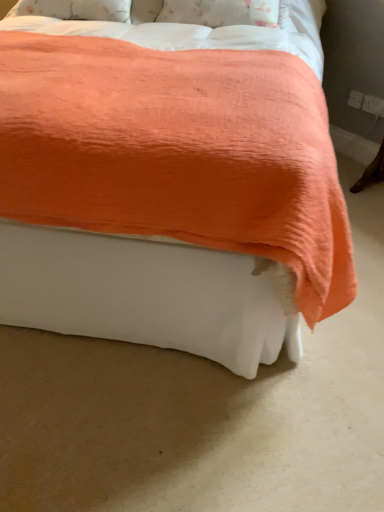
From the picture: Measure the distance between point (103, 156) and camera.

Point (103, 156) is 36.34 inches from camera.

This screenshot has width=384, height=512. What do you see at coordinates (170, 182) in the screenshot? I see `coral soft blanket at center` at bounding box center [170, 182].

Locate an element on the screen. The image size is (384, 512). coral soft blanket at center is located at coordinates 170,182.

Locate an element on the screen. The width and height of the screenshot is (384, 512). coral soft blanket at center is located at coordinates (170, 182).